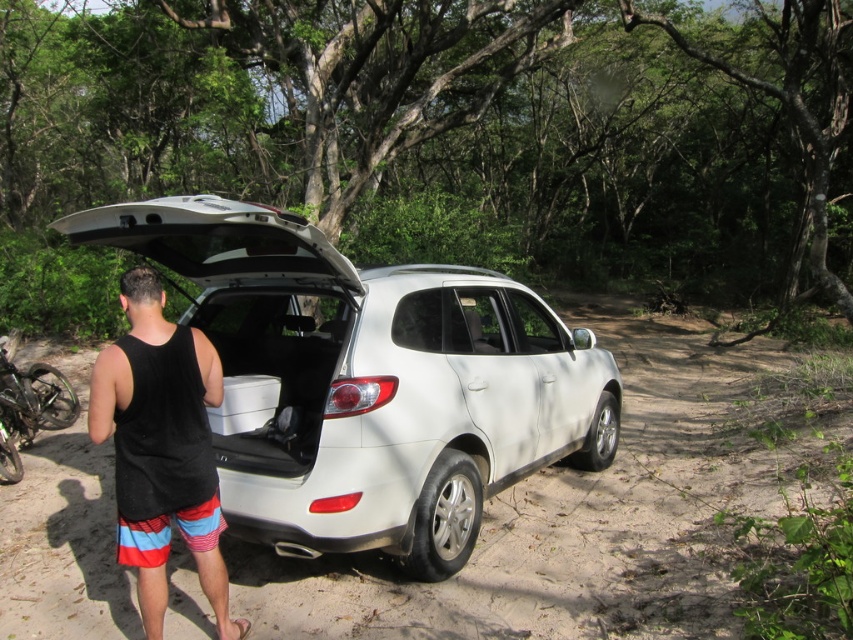
Question: Which object is positioned closest to the white matte suv at center?

Choices:
 (A) dirt track at center
 (B) black fabric tank top at center

Answer: (A)

Question: Can you confirm if white matte suv at center is positioned below dirt track at center?

Choices:
 (A) yes
 (B) no

Answer: (B)

Question: Observing the image, what is the correct spatial positioning of dirt track at center in reference to black fabric tank top at center?

Choices:
 (A) above
 (B) below

Answer: (B)

Question: Among these objects, which one is farthest from the camera?

Choices:
 (A) black fabric tank top at center
 (B) dirt track at center

Answer: (B)

Question: Which object is closer to the camera taking this photo?

Choices:
 (A) dirt track at center
 (B) black fabric tank top at center

Answer: (B)

Question: Is white matte suv at center to the right of dirt track at center from the viewer's perspective?

Choices:
 (A) yes
 (B) no

Answer: (B)